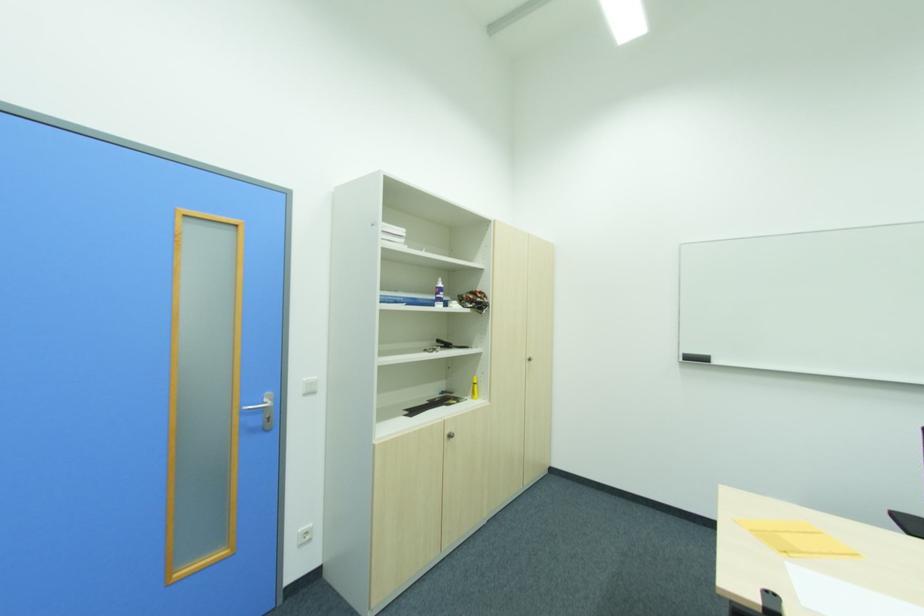
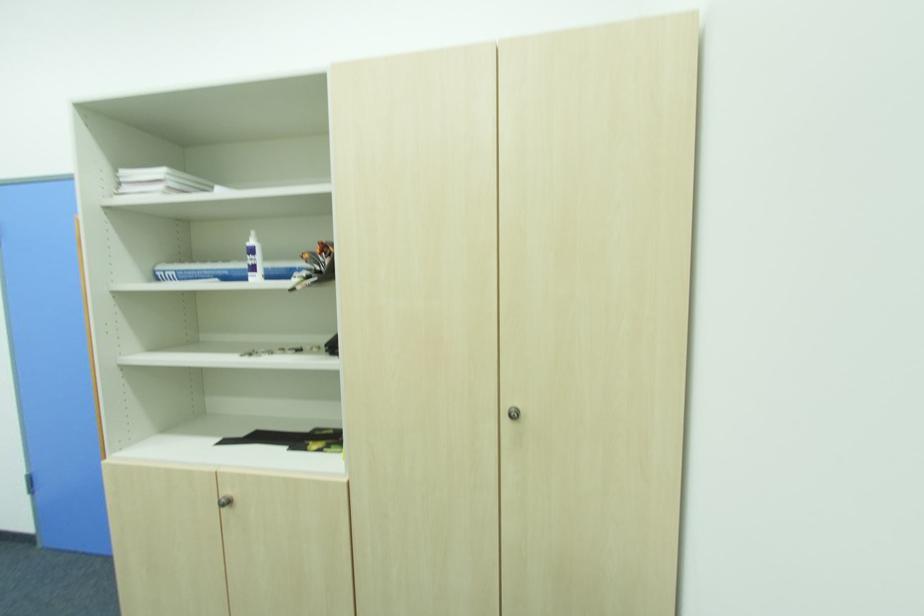
Find the pixel in the second image that matches point 482,294 in the first image.

(321, 252)